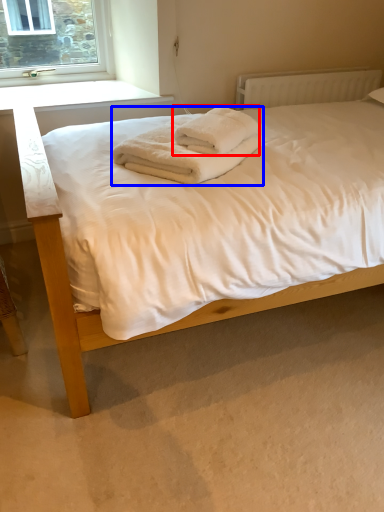
Question: Which of the following is the farthest to the observer, towel (highlighted by a red box) or bath towel (highlighted by a blue box)?

Choices:
 (A) towel
 (B) bath towel

Answer: (A)